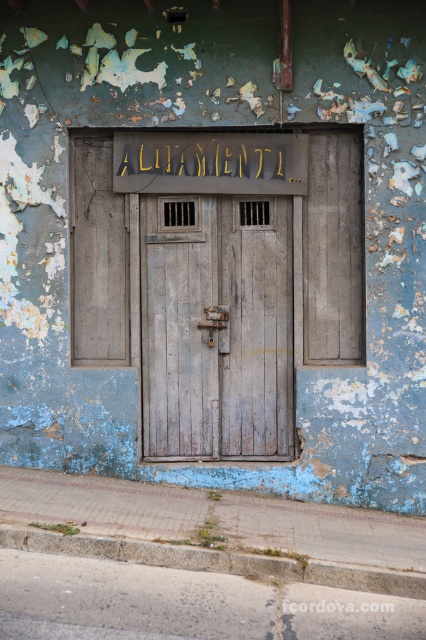
You are standing in front of the aged building and looking at the central wooden door with two small rectangular windows. There are two points marked on the door. Which point is closer to you, point (175, 323) or point (143, 156)?

Point (175, 323) is further to the viewer than point (143, 156), so point (143, 156) is closer to you.

You are a painter hired to restore the faded blue wall around the weathered wood door at center and the gold metallic sign at upper center. Which object requires more attention to its surface condition due to its size?

The weathered wood door at center is bigger than the gold metallic sign at upper center, so it requires more attention to its surface condition due to its larger size.

Based on the photo, you are standing in front of the building and want to enter through the weathered wood door at center. To do so, you need to locate the keyhole. Since the gold metallic sign at upper center is blocking your view, which direction should you move to see the door handle and keyhole clearly?

Since the weathered wood door at center is to the right of the gold metallic sign at upper center, you should move to the left of the gold metallic sign at upper center to see the door handle and keyhole clearly.